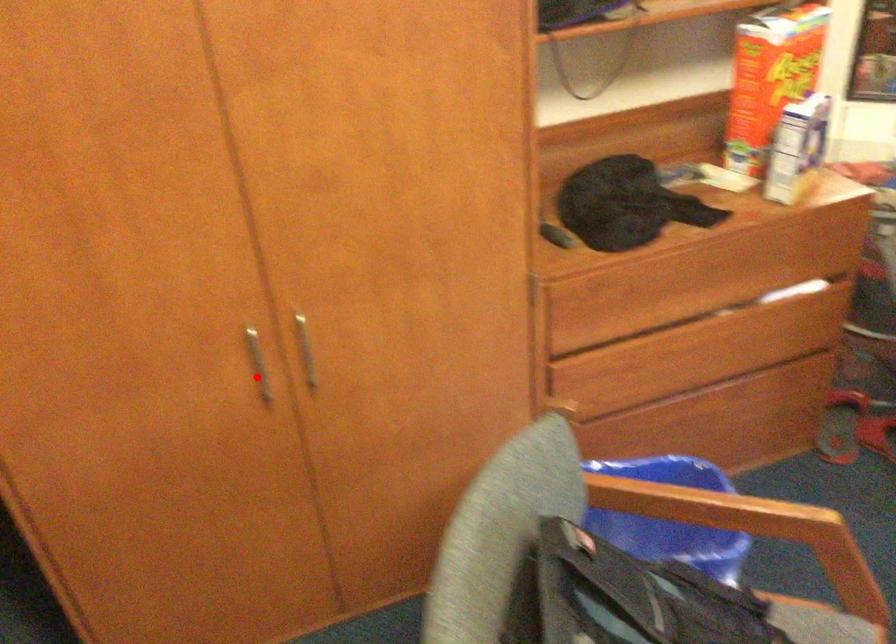
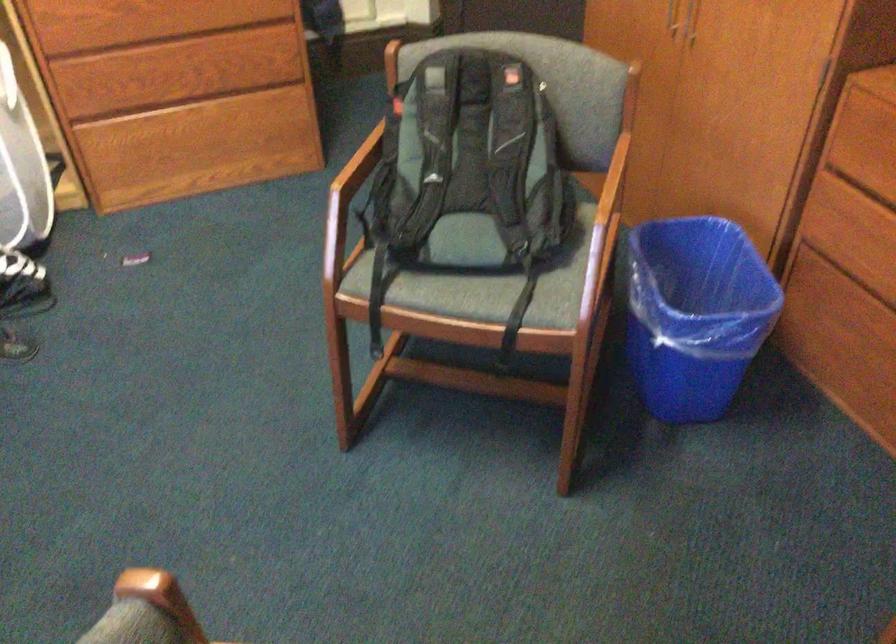
The point at the highlighted location is marked in the first image. Where is the corresponding point in the second image?

(670, 17)